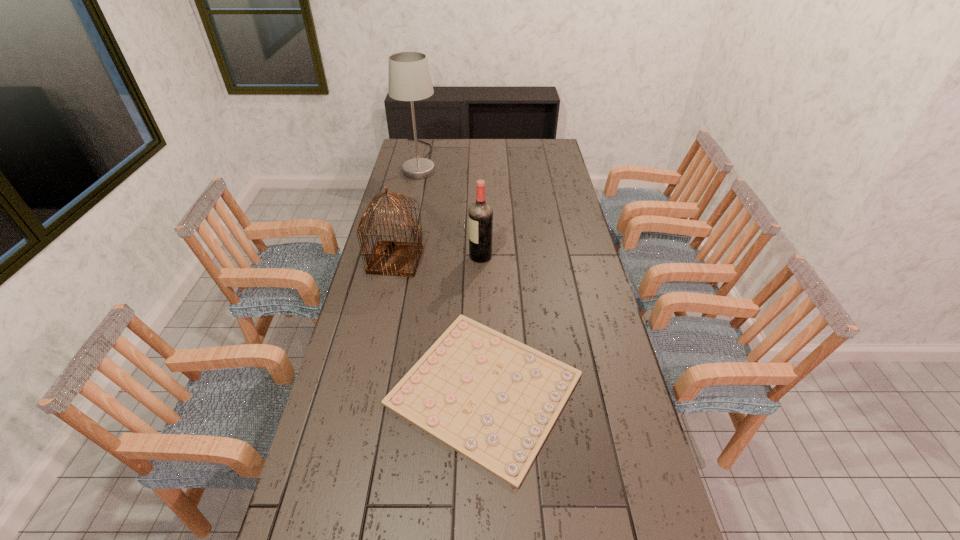
Locate an element on the screen. free space at the far left corner is located at coordinates (419, 152).

What are the coordinates of `free space between the gameboard and the liquor` in the screenshot? It's located at (483, 322).

Locate an element on the screen. free space between the nearest object and the liquor is located at coordinates (483, 322).

Where is `free space between the gameboard and the liquor`? free space between the gameboard and the liquor is located at coordinates (483, 322).

You are a GUI agent. You are given a task and a screenshot of the screen. Output one action in this format:
    pyautogui.click(x=<x>, y=<y>)
    Task: Click on the vacant space that is in between the liquor and the gameboard
    The height and width of the screenshot is (540, 960).
    Given the screenshot: What is the action you would take?
    pyautogui.click(x=483, y=322)

The width and height of the screenshot is (960, 540). In order to click on empty location between the farthest object and the shortest object in this screenshot , I will do `click(453, 274)`.

At what (x,y) coordinates should I click in order to perform the action: click on vacant area that lies between the gameboard and the liquor. Please return your answer as a coordinate pair (x, y). Looking at the image, I should click on (483, 322).

Locate an element on the screen. The image size is (960, 540). free space between the nearest object and the liquor is located at coordinates (483, 322).

Where is `empty location between the farthest object and the shortest object`? empty location between the farthest object and the shortest object is located at coordinates (453, 274).

The image size is (960, 540). What are the coordinates of `vacant space in between the nearest object and the tallest object` in the screenshot? It's located at (453, 274).